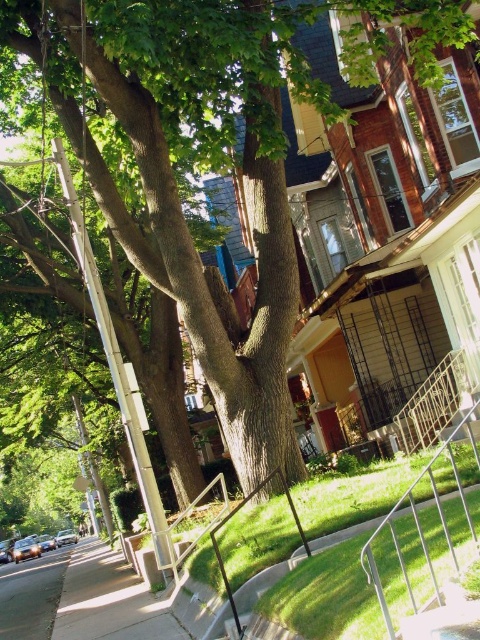
Is green grass at lower right bigger than silver metallic car at lower left?

Actually, green grass at lower right might be smaller than silver metallic car at lower left.

Does point (315, 554) lie in front of point (66, 540)?

Yes, it is in front of point (66, 540).

The width and height of the screenshot is (480, 640). Identify the location of green grass at lower right. (265, 579).

Describe the element at coordinates (109, 600) in the screenshot. I see `smooth concrete sidewalk at lower left` at that location.

In the scene shown: Between smooth concrete sidewalk at lower left and silver metallic car at lower left, which one appears on the left side from the viewer's perspective?

From the viewer's perspective, silver metallic car at lower left appears more on the left side.

Locate an element on the screen. smooth concrete sidewalk at lower left is located at coordinates (109, 600).

Locate an element on the screen. smooth concrete sidewalk at lower left is located at coordinates (109, 600).

Is smooth asphalt pavement at lower left positioned in front of silver metallic car at lower left?

Yes, smooth asphalt pavement at lower left is in front of silver metallic car at lower left.

Is smooth asphalt pavement at lower left bigger than silver metallic car at lower left?

Correct, smooth asphalt pavement at lower left is larger in size than silver metallic car at lower left.

Describe the element at coordinates (32, 595) in the screenshot. The image size is (480, 640). I see `smooth asphalt pavement at lower left` at that location.

Where is `smooth asphalt pavement at lower left`? smooth asphalt pavement at lower left is located at coordinates (32, 595).